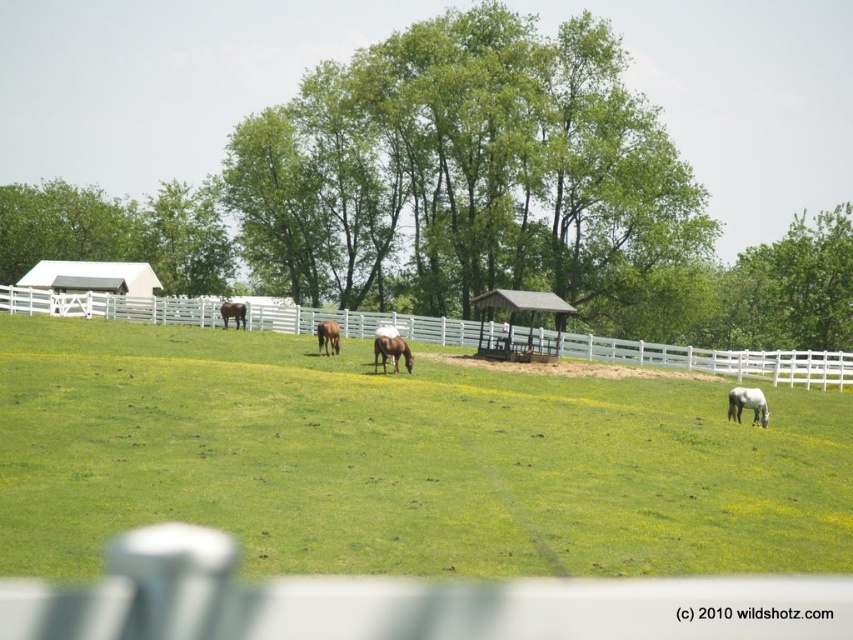
Question: Estimate the real-world distances between objects in this image. Which object is farther from the white wooden fence at center?

Choices:
 (A) brown matte horse at center-left
 (B) brown matte horse at center
 (C) green grassy field at center
 (D) white glossy horse at lower right

Answer: (D)

Question: Which point is farther to the camera?

Choices:
 (A) brown matte horse at center
 (B) white wooden fence at center
 (C) brown matte horse at center-left
 (D) white glossy horse at lower right

Answer: (C)

Question: Is green leafy tree at center bigger than white wooden fence at center?

Choices:
 (A) yes
 (B) no

Answer: (A)

Question: Does green grassy field at center have a larger size compared to green leafy tree at center?

Choices:
 (A) no
 (B) yes

Answer: (A)

Question: Based on their relative distances, which object is nearer to the white wooden fence at center?

Choices:
 (A) brown matte horse at center
 (B) green leafy tree at center

Answer: (A)

Question: Does green grassy field at center appear under white wooden fence at center?

Choices:
 (A) yes
 (B) no

Answer: (A)